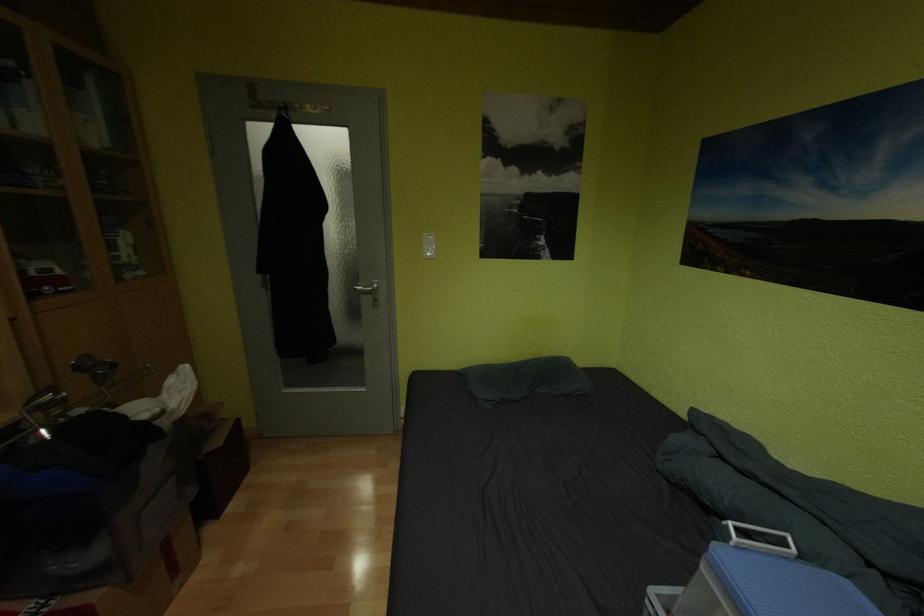
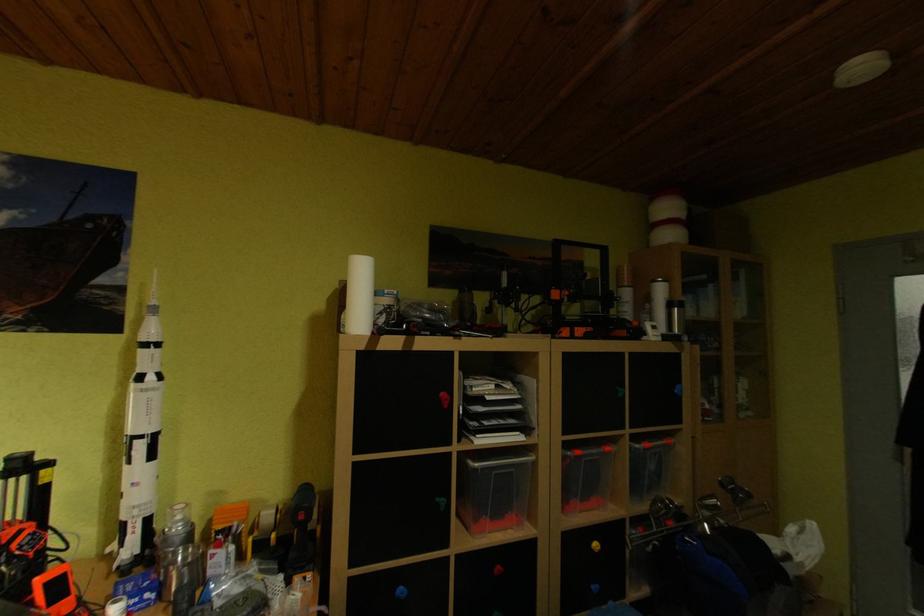
Question: How did the camera likely rotate?

Choices:
 (A) Left
 (B) Right
 (C) Up
 (D) Down

Answer: (A)